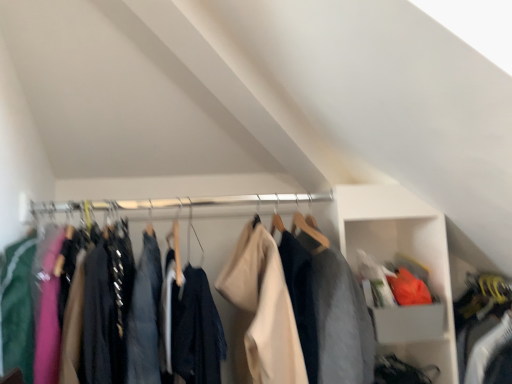
Question: Would you say matte black jacket at center is part of white plastic cabinet at upper right's contents?

Choices:
 (A) no
 (B) yes

Answer: (A)

Question: Can you confirm if white plastic cabinet at upper right is taller than matte black jacket at center?

Choices:
 (A) no
 (B) yes

Answer: (B)

Question: From the image's perspective, does white plastic cabinet at upper right appear higher than matte black jacket at center?

Choices:
 (A) yes
 (B) no

Answer: (B)

Question: Are white plastic cabinet at upper right and matte black jacket at center far apart?

Choices:
 (A) no
 (B) yes

Answer: (A)

Question: Does white plastic cabinet at upper right lie behind matte black jacket at center?

Choices:
 (A) no
 (B) yes

Answer: (B)

Question: Is white plastic cabinet at upper right oriented away from matte black jacket at center?

Choices:
 (A) no
 (B) yes

Answer: (A)

Question: Is matte black jacket at center positioned before white plastic cabinet at upper right?

Choices:
 (A) yes
 (B) no

Answer: (A)

Question: Does matte black jacket at center appear on the left side of white plastic cabinet at upper right?

Choices:
 (A) no
 (B) yes

Answer: (B)

Question: Is matte black jacket at center located outside white plastic cabinet at upper right?

Choices:
 (A) no
 (B) yes

Answer: (B)

Question: From a real-world perspective, does matte black jacket at center stand above white plastic cabinet at upper right?

Choices:
 (A) yes
 (B) no

Answer: (A)

Question: Is matte black jacket at center smaller than white plastic cabinet at upper right?

Choices:
 (A) no
 (B) yes

Answer: (A)

Question: Is white plastic cabinet at upper right at the back of matte black jacket at center?

Choices:
 (A) yes
 (B) no

Answer: (B)

Question: From a real-world perspective, is white plastic cabinet at upper right positioned above or below matte black jacket at center?

Choices:
 (A) above
 (B) below

Answer: (B)